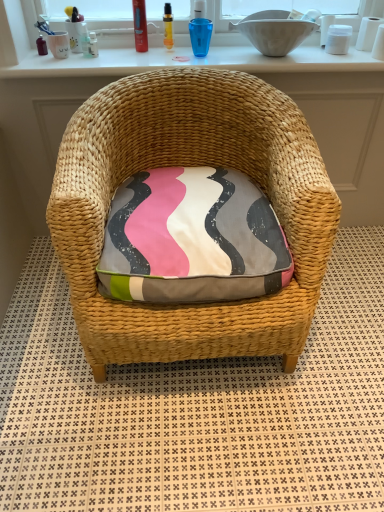
Question: From a real-world perspective, is natural woven chair at center under woven straw chair at center?

Choices:
 (A) no
 (B) yes

Answer: (A)

Question: From the image's perspective, is natural woven chair at center over woven straw chair at center?

Choices:
 (A) yes
 (B) no

Answer: (A)

Question: Considering the relative sizes of natural woven chair at center and woven straw chair at center in the image provided, is natural woven chair at center shorter than woven straw chair at center?

Choices:
 (A) no
 (B) yes

Answer: (A)

Question: From the image's perspective, does natural woven chair at center appear lower than woven straw chair at center?

Choices:
 (A) yes
 (B) no

Answer: (B)

Question: Considering the relative sizes of natural woven chair at center and woven straw chair at center in the image provided, is natural woven chair at center smaller than woven straw chair at center?

Choices:
 (A) yes
 (B) no

Answer: (A)

Question: Considering the relative sizes of natural woven chair at center and woven straw chair at center in the image provided, is natural woven chair at center taller than woven straw chair at center?

Choices:
 (A) yes
 (B) no

Answer: (A)

Question: Does white ceramic bowl at upper center appear on the right side of translucent plastic vial at upper center, which is the 3th toiletry from left to right?

Choices:
 (A) no
 (B) yes

Answer: (B)

Question: Is white ceramic bowl at upper center far away from translucent plastic vial at upper center, the 1th toiletry positioned from the right?

Choices:
 (A) yes
 (B) no

Answer: (B)

Question: Considering the relative sizes of white ceramic bowl at upper center and translucent plastic vial at upper center, the 1th toiletry positioned from the right, in the image provided, is white ceramic bowl at upper center taller than translucent plastic vial at upper center, the 1th toiletry positioned from the right,?

Choices:
 (A) yes
 (B) no

Answer: (B)

Question: Would you say white ceramic bowl at upper center is outside translucent plastic vial at upper center, the 1th toiletry positioned from the right?

Choices:
 (A) yes
 (B) no

Answer: (A)

Question: Can you see white ceramic bowl at upper center touching translucent plastic vial at upper center, which is the 3th toiletry from left to right?

Choices:
 (A) no
 (B) yes

Answer: (A)

Question: Is white ceramic bowl at upper center positioned before translucent plastic vial at upper center, which is the 3th toiletry from left to right?

Choices:
 (A) no
 (B) yes

Answer: (B)

Question: Is white glossy window sill at upper center positioned with its back to natural woven chair at center?

Choices:
 (A) no
 (B) yes

Answer: (A)